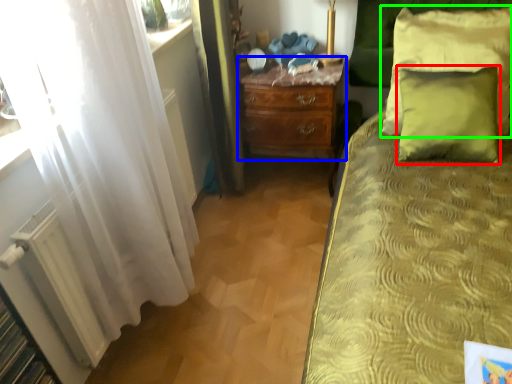
Question: Estimate the real-world distances between objects in this image. Which object is closer to pillow (highlighted by a red box), nightstand (highlighted by a blue box) or pillow (highlighted by a green box)?

Choices:
 (A) nightstand
 (B) pillow

Answer: (B)